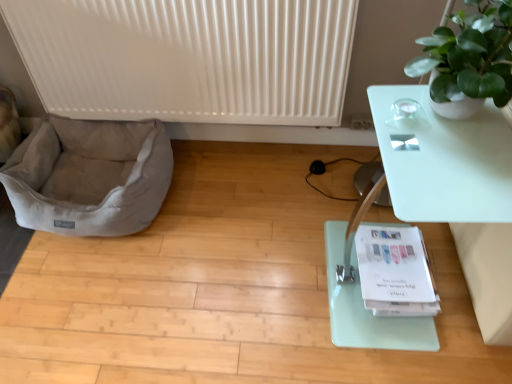
Question: Considering the relative sizes of transparent glass table at right and white ribbed radiator at upper center in the image provided, is transparent glass table at right thinner than white ribbed radiator at upper center?

Choices:
 (A) yes
 (B) no

Answer: (B)

Question: Is transparent glass table at right smaller than white ribbed radiator at upper center?

Choices:
 (A) yes
 (B) no

Answer: (B)

Question: From a real-world perspective, is transparent glass table at right on top of white ribbed radiator at upper center?

Choices:
 (A) yes
 (B) no

Answer: (B)

Question: Is the position of transparent glass table at right more distant than that of white ribbed radiator at upper center?

Choices:
 (A) yes
 (B) no

Answer: (B)

Question: Does transparent glass table at right touch white ribbed radiator at upper center?

Choices:
 (A) yes
 (B) no

Answer: (B)

Question: Is transparent glass table at right at the right side of white ribbed radiator at upper center?

Choices:
 (A) yes
 (B) no

Answer: (A)

Question: Could you tell me if light gray fabric dog bed at lower left is facing green matte plant at upper right?

Choices:
 (A) no
 (B) yes

Answer: (A)

Question: Is light gray fabric dog bed at lower left outside green matte plant at upper right?

Choices:
 (A) yes
 (B) no

Answer: (A)

Question: Does light gray fabric dog bed at lower left have a lesser width compared to green matte plant at upper right?

Choices:
 (A) no
 (B) yes

Answer: (A)

Question: Considering the relative sizes of light gray fabric dog bed at lower left and green matte plant at upper right in the image provided, is light gray fabric dog bed at lower left wider than green matte plant at upper right?

Choices:
 (A) yes
 (B) no

Answer: (A)

Question: From a real-world perspective, is light gray fabric dog bed at lower left positioned over green matte plant at upper right based on gravity?

Choices:
 (A) yes
 (B) no

Answer: (B)

Question: Is light gray fabric dog bed at lower left next to green matte plant at upper right and touching it?

Choices:
 (A) no
 (B) yes

Answer: (A)

Question: Is transparent glass table at right turned away from light gray fabric dog bed at lower left?

Choices:
 (A) no
 (B) yes

Answer: (A)